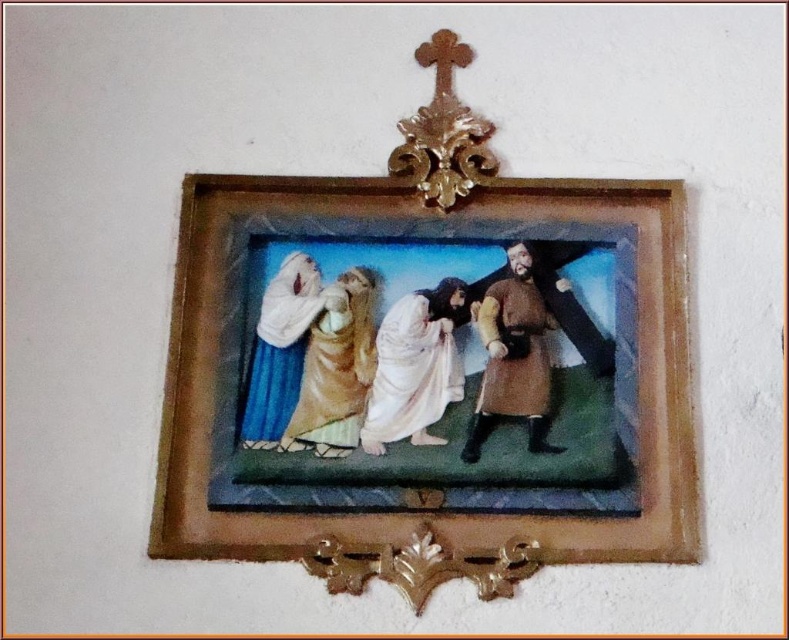
Is white clothed figure at center taller than gold ornate crucifix at upper center?

No.

Does white clothed figure at center lie in front of gold ornate crucifix at upper center?

Yes, white clothed figure at center is closer to the viewer.

The width and height of the screenshot is (789, 640). Describe the element at coordinates (414, 365) in the screenshot. I see `white clothed figure at center` at that location.

The image size is (789, 640). I want to click on white clothed figure at center, so click(x=414, y=365).

Between white clothed figure at center and matte gold robe at center, which one appears on the left side from the viewer's perspective?

From the viewer's perspective, matte gold robe at center appears more on the left side.

Is point (423, 339) positioned before point (346, 406)?

No, it is not.

I want to click on white clothed figure at center, so click(x=414, y=365).

Is white clothed figure at center taller than brown leather coat at center?

Incorrect, white clothed figure at center's height is not larger of brown leather coat at center's.

Between white clothed figure at center and brown leather coat at center, which one has less height?

Standing shorter between the two is white clothed figure at center.

Find the location of a particular element. white clothed figure at center is located at coordinates (414, 365).

You are a GUI agent. You are given a task and a screenshot of the screen. Output one action in this format:
    pyautogui.click(x=<x>, y=<y>)
    Task: Click on the white clothed figure at center
    The width and height of the screenshot is (789, 640).
    Given the screenshot: What is the action you would take?
    pyautogui.click(x=414, y=365)